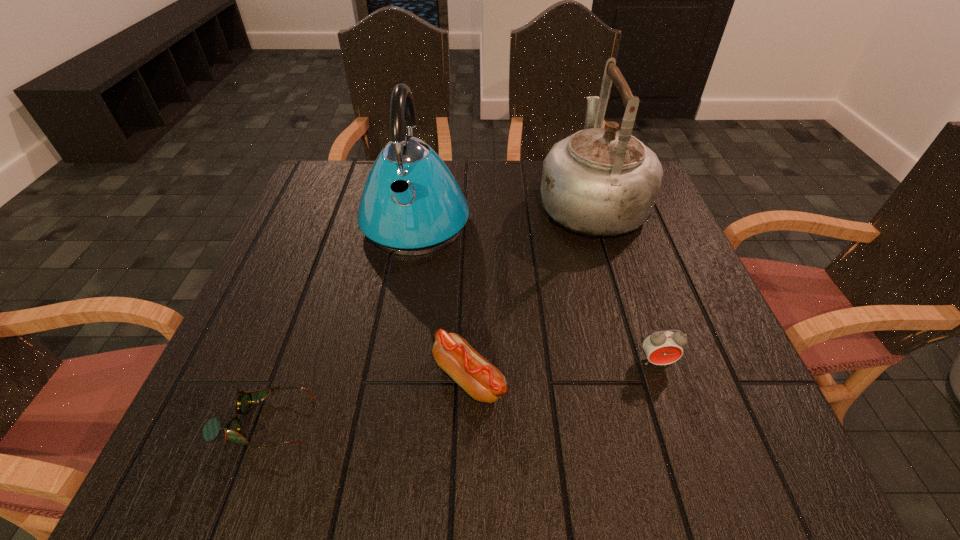
At what (x,y) coordinates should I click in order to perform the action: click on the right kettle. Please return your answer as a coordinate pair (x, y). This screenshot has height=540, width=960. Looking at the image, I should click on click(599, 181).

Locate an element on the screen. The width and height of the screenshot is (960, 540). the left kettle is located at coordinates (411, 204).

At what (x,y) coordinates should I click in order to perform the action: click on alarm clock. Please return your answer as a coordinate pair (x, y). The image size is (960, 540). Looking at the image, I should click on (663, 347).

This screenshot has height=540, width=960. I want to click on the second shortest object, so pyautogui.click(x=473, y=373).

The image size is (960, 540). In order to click on the shortest object in this screenshot , I will do `click(211, 429)`.

You are a GUI agent. You are given a task and a screenshot of the screen. Output one action in this format:
    pyautogui.click(x=<x>, y=<y>)
    Task: Click on the vacant space situated 0.100m at the spout of the left kettle
    The height and width of the screenshot is (540, 960).
    Given the screenshot: What is the action you would take?
    [x=403, y=296]

Identify the location of vacant position located on the face of the third shortest object. The width and height of the screenshot is (960, 540). (669, 401).

Locate an element on the screen. The image size is (960, 540). vacant space located on the right of the sausage is located at coordinates (728, 378).

Locate an element on the screen. vacant space located on the front-facing side of the shortest object is located at coordinates (347, 422).

Locate an element on the screen. object that is at the near edge is located at coordinates (211, 429).